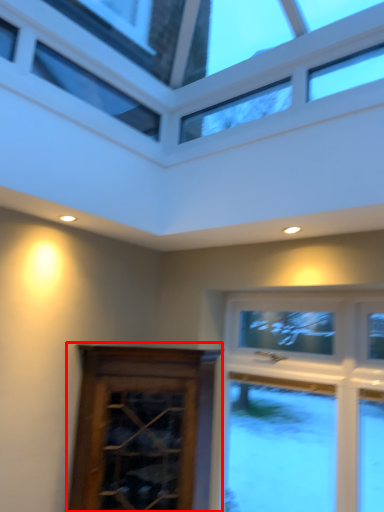
Question: Where is screen door (annotated by the red box) located in relation to window in the image?

Choices:
 (A) left
 (B) right

Answer: (A)